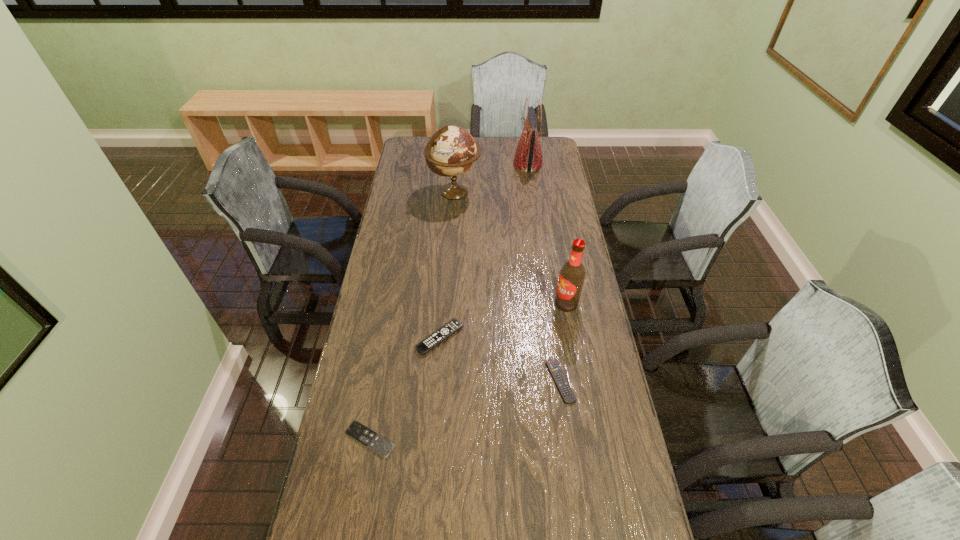
Find the location of a particular element. The height and width of the screenshot is (540, 960). vacant region located on the left of the farthest object is located at coordinates pos(441,164).

Where is `free spot located on the left of the third farthest object`? Image resolution: width=960 pixels, height=540 pixels. free spot located on the left of the third farthest object is located at coordinates (534, 303).

Where is `vacant space situated on the front of the fourth farthest object`? The height and width of the screenshot is (540, 960). vacant space situated on the front of the fourth farthest object is located at coordinates (436, 388).

This screenshot has width=960, height=540. Identify the location of free region located on the front of the second nearest object. (579, 511).

Locate an element on the screen. This screenshot has width=960, height=540. free space located 0.050m on the right of the nearest remote control is located at coordinates (414, 440).

Find the location of a particular element. This screenshot has width=960, height=540. object that is at the far edge is located at coordinates (528, 157).

Where is `globe present at the left edge`? globe present at the left edge is located at coordinates (452, 150).

You are a GUI agent. You are given a task and a screenshot of the screen. Output one action in this format:
    pyautogui.click(x=<x>, y=<y>)
    Task: Click on the remote control that is at the left edge
    This screenshot has height=540, width=960.
    Given the screenshot: What is the action you would take?
    pyautogui.click(x=365, y=436)

Locate an element on the screen. Image resolution: width=960 pixels, height=540 pixels. handbag that is at the right edge is located at coordinates (528, 157).

You are a GUI agent. You are given a task and a screenshot of the screen. Output one action in this format:
    pyautogui.click(x=<x>, y=<y>)
    Task: Click on the beer bottle that is at the right edge
    The width and height of the screenshot is (960, 540).
    Given the screenshot: What is the action you would take?
    point(572,274)